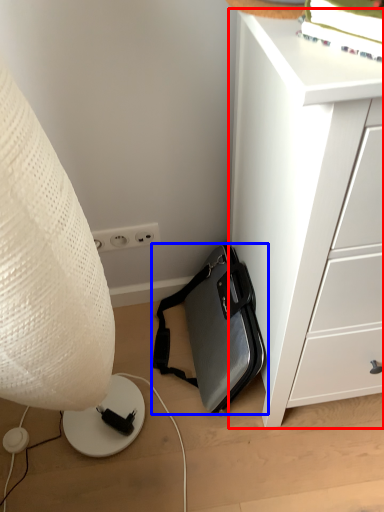
Question: Which object is further to the camera taking this photo, chest of drawers (highlighted by a red box) or luggage and bags (highlighted by a blue box)?

Choices:
 (A) chest of drawers
 (B) luggage and bags

Answer: (B)